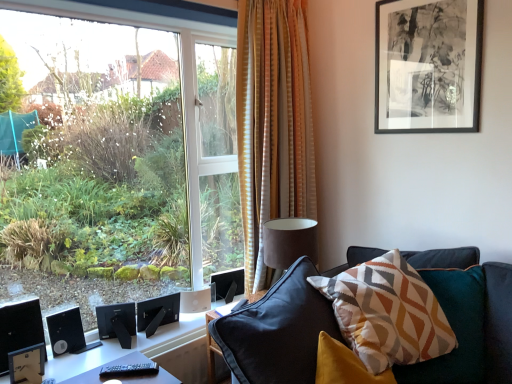
In order to click on vacant region in front of black matte speaker at lower left, the second speaker viewed from the right in this screenshot , I will do `click(83, 362)`.